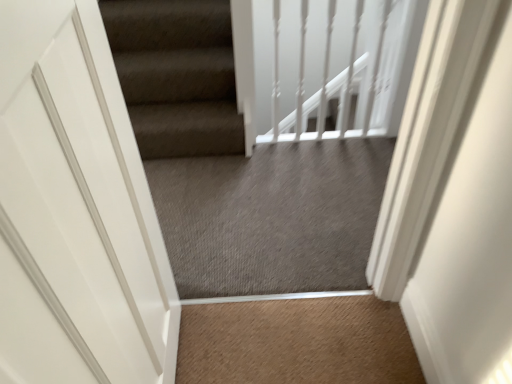
Question: From the image's perspective, is gray carpet at center above or below white glossy balustrade at upper center?

Choices:
 (A) above
 (B) below

Answer: (B)

Question: Is point (170, 165) closer or farther from the camera than point (258, 56)?

Choices:
 (A) farther
 (B) closer

Answer: (A)

Question: Based on their relative distances, which object is nearer to the white matte door at left?

Choices:
 (A) white glossy balustrade at upper center
 (B) gray carpet at center

Answer: (B)

Question: Estimate the real-world distances between objects in this image. Which object is closer to the gray carpet at center?

Choices:
 (A) white glossy balustrade at upper center
 (B) white matte door at left

Answer: (A)